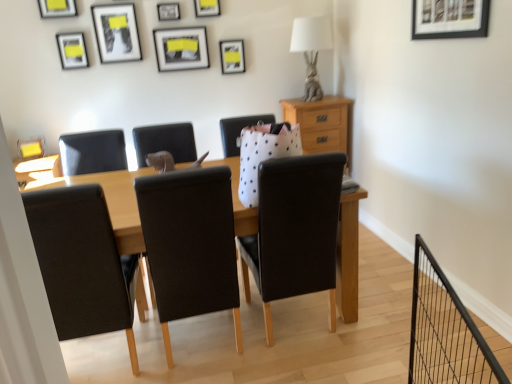
Image resolution: width=512 pixels, height=384 pixels. Find the location of `vacant region above brushed metal picture frame at upper left, the fifth picture frame when ordered from back to front (from a real-world perspective)`. vacant region above brushed metal picture frame at upper left, the fifth picture frame when ordered from back to front (from a real-world perspective) is located at coordinates (33, 139).